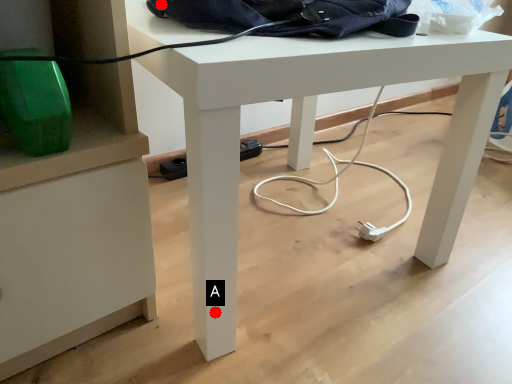
Question: Two points are circled on the image, labeled by A and B beside each circle. Which point appears closest to the camera in this image?

Choices:
 (A) A is closer
 (B) B is closer

Answer: (B)